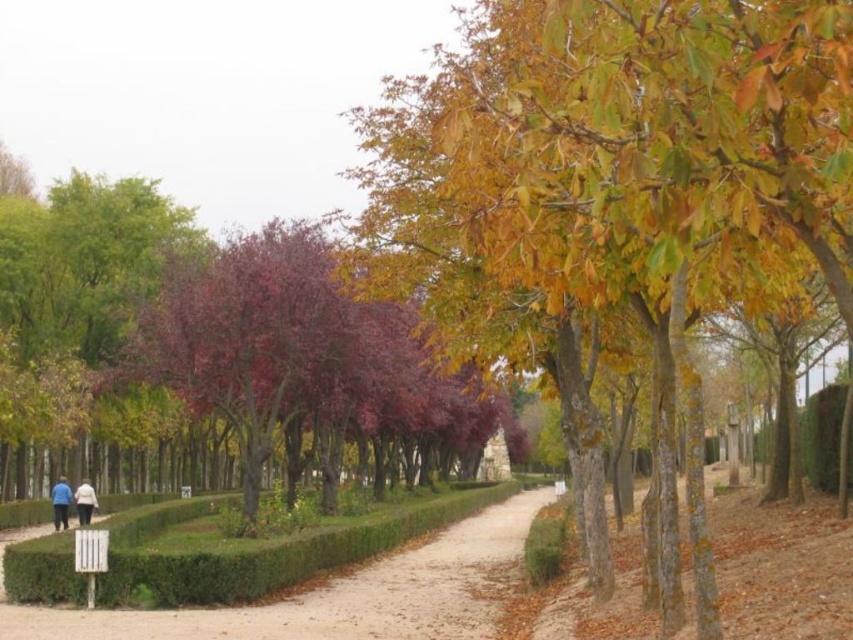
You are standing at the point marked by the coordinates point (613, 152) in the park. What is the nearest object to you?

The nearest object to you is the yellow green bark tree at center right, as the point (613, 152) indicates its location.